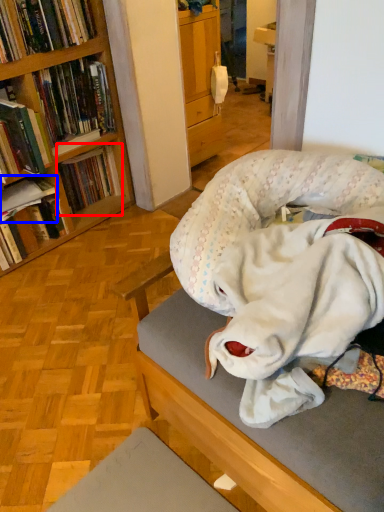
Question: Which point is further to the camera, book (highlighted by a red box) or book (highlighted by a blue box)?

Choices:
 (A) book
 (B) book

Answer: (A)